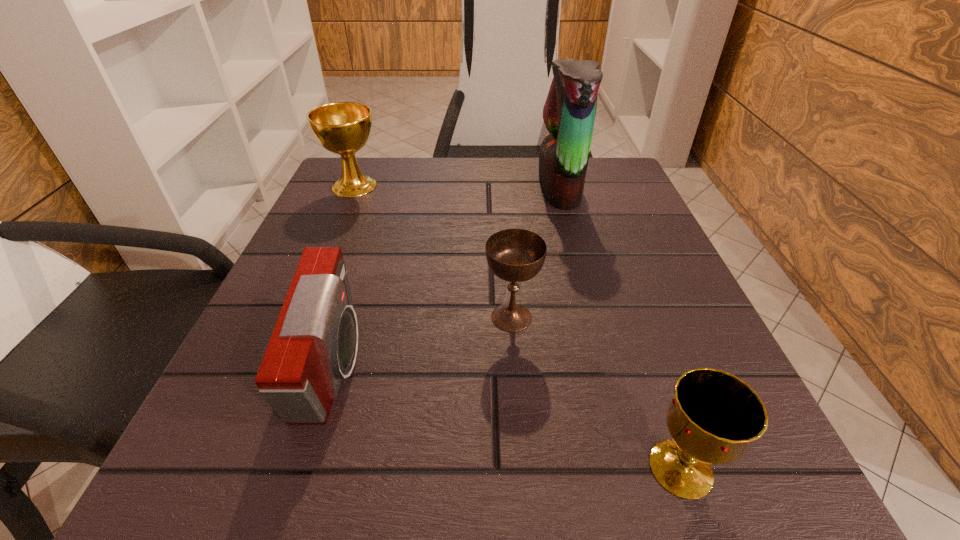
Where is `object that is the second closest to the camera`? This screenshot has width=960, height=540. object that is the second closest to the camera is located at coordinates (343, 128).

Identify which chalice is located as the nearest to the second chalice from right to left. Please provide its 2D coordinates. Your answer should be formatted as a tuple, i.e. [(x, y)], where the tuple contains the x and y coordinates of a point satisfying the conditions above.

[(714, 415)]

Select which chalice is the second closest to the parrot. Please provide its 2D coordinates. Your answer should be formatted as a tuple, i.e. [(x, y)], where the tuple contains the x and y coordinates of a point satisfying the conditions above.

[(343, 128)]

This screenshot has height=540, width=960. Find the location of `vacant area that satisfies the following two spatial constraints: 1. at the face of the nearest chalice; 2. on the left side of the tallest object`. vacant area that satisfies the following two spatial constraints: 1. at the face of the nearest chalice; 2. on the left side of the tallest object is located at coordinates (635, 469).

Find the location of a particular element. free space that satisfies the following two spatial constraints: 1. on the back side of the rightmost chalice; 2. on the front-facing side of the camera is located at coordinates (646, 368).

You are a GUI agent. You are given a task and a screenshot of the screen. Output one action in this format:
    pyautogui.click(x=<x>, y=<y>)
    Task: Click on the free point that satisfies the following two spatial constraints: 1. on the front-facing side of the nearest chalice; 2. on the right side of the camera
    Image resolution: width=960 pixels, height=540 pixels.
    Given the screenshot: What is the action you would take?
    tap(303, 469)

Where is `vacant space that satisfies the following two spatial constraints: 1. on the front-facing side of the nearest chalice; 2. on the left side of the camera`? The height and width of the screenshot is (540, 960). vacant space that satisfies the following two spatial constraints: 1. on the front-facing side of the nearest chalice; 2. on the left side of the camera is located at coordinates (303, 469).

What are the coordinates of `vacant area in the image that satisfies the following two spatial constraints: 1. on the front-facing side of the camera; 2. on the back side of the nearest chalice` in the screenshot? It's located at [303, 469].

Find the location of a particular element. free spot that satisfies the following two spatial constraints: 1. on the back side of the rightmost chalice; 2. at the face of the tallest object is located at coordinates coord(583,188).

Locate an element on the screen. Image resolution: width=960 pixels, height=540 pixels. free space that satisfies the following two spatial constraints: 1. at the face of the parrot; 2. on the left side of the nearest chalice is located at coordinates (635, 469).